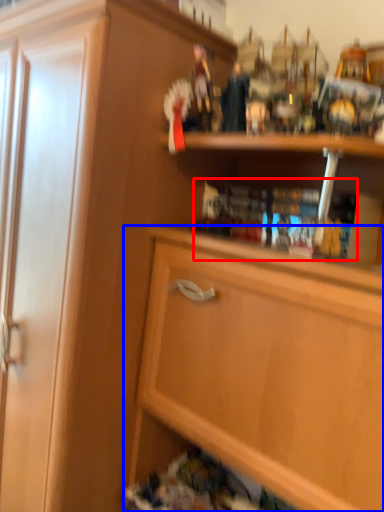
Question: Which of the following is the farthest to the observer, book (highlighted by a red box) or cabinetry (highlighted by a blue box)?

Choices:
 (A) book
 (B) cabinetry

Answer: (A)